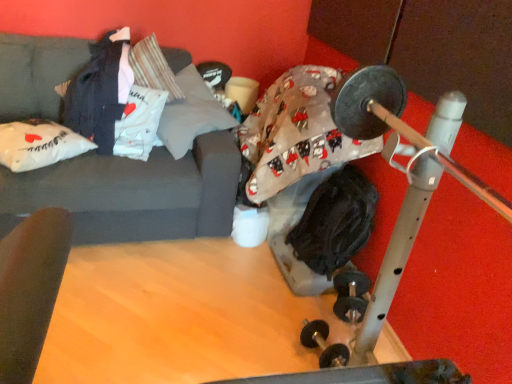
Question: Is gray fabric pillow at upper center, the first pillow positioned from the right, inside black fabric at center, which is the second clothing from left to right?

Choices:
 (A) yes
 (B) no

Answer: (B)

Question: Does black fabric at center, which is the second clothing from left to right, have a greater height compared to gray fabric pillow at upper center, positioned as the second pillow in left-to-right order?

Choices:
 (A) yes
 (B) no

Answer: (A)

Question: From a real-world perspective, is black fabric at center, acting as the first clothing starting from the bottom, positioned under gray fabric pillow at upper center, the first pillow positioned from the right, based on gravity?

Choices:
 (A) no
 (B) yes

Answer: (B)

Question: Is black fabric at center, which is counted as the first clothing, starting from the right, placed right next to gray fabric pillow at upper center, positioned as the second pillow in left-to-right order?

Choices:
 (A) no
 (B) yes

Answer: (A)

Question: Is black fabric at center, the 2th clothing in the top-to-bottom sequence, further to camera compared to gray fabric pillow at upper center, positioned as the second pillow in left-to-right order?

Choices:
 (A) no
 (B) yes

Answer: (A)

Question: Considering the positions of gray fabric pillow at upper center, the first pillow positioned from the right, and white fabric pillow at left, arranged as the 2th pillow when viewed from the right, in the image, is gray fabric pillow at upper center, the first pillow positioned from the right, taller or shorter than white fabric pillow at left, arranged as the 2th pillow when viewed from the right,?

Choices:
 (A) tall
 (B) short

Answer: (A)

Question: From a real-world perspective, relative to white fabric pillow at left, arranged as the 2th pillow when viewed from the right, is gray fabric pillow at upper center, positioned as the second pillow in left-to-right order, vertically above or below?

Choices:
 (A) above
 (B) below

Answer: (A)

Question: Visually, is gray fabric pillow at upper center, the first pillow positioned from the right, positioned to the left or to the right of white fabric pillow at left, arranged as the 2th pillow when viewed from the right?

Choices:
 (A) right
 (B) left

Answer: (A)

Question: In the image, is gray fabric pillow at upper center, positioned as the second pillow in left-to-right order, positioned in front of or behind white fabric pillow at left, arranged as the 2th pillow when viewed from the right?

Choices:
 (A) front
 (B) behind

Answer: (B)

Question: In terms of size, does dark gray fabric couch at upper left appear bigger or smaller than white fabric pillow at left, marked as the first pillow in a left-to-right arrangement?

Choices:
 (A) small
 (B) big

Answer: (B)

Question: From a real-world perspective, relative to white fabric pillow at left, marked as the first pillow in a left-to-right arrangement, is dark gray fabric couch at upper left vertically above or below?

Choices:
 (A) below
 (B) above

Answer: (A)

Question: Would you say dark gray fabric couch at upper left is inside or outside white fabric pillow at left, marked as the first pillow in a left-to-right arrangement?

Choices:
 (A) inside
 (B) outside

Answer: (B)

Question: Looking at their shapes, would you say dark gray fabric couch at upper left is wider or thinner than white fabric pillow at left, marked as the first pillow in a left-to-right arrangement?

Choices:
 (A) thin
 (B) wide

Answer: (B)

Question: Is black fabric at center, the 2th clothing in the top-to-bottom sequence, to the left or to the right of gray fabric pillow at upper center, the first pillow positioned from the right, in the image?

Choices:
 (A) left
 (B) right

Answer: (B)

Question: Does point (342, 205) appear closer or farther from the camera than point (224, 129)?

Choices:
 (A) closer
 (B) farther

Answer: (A)